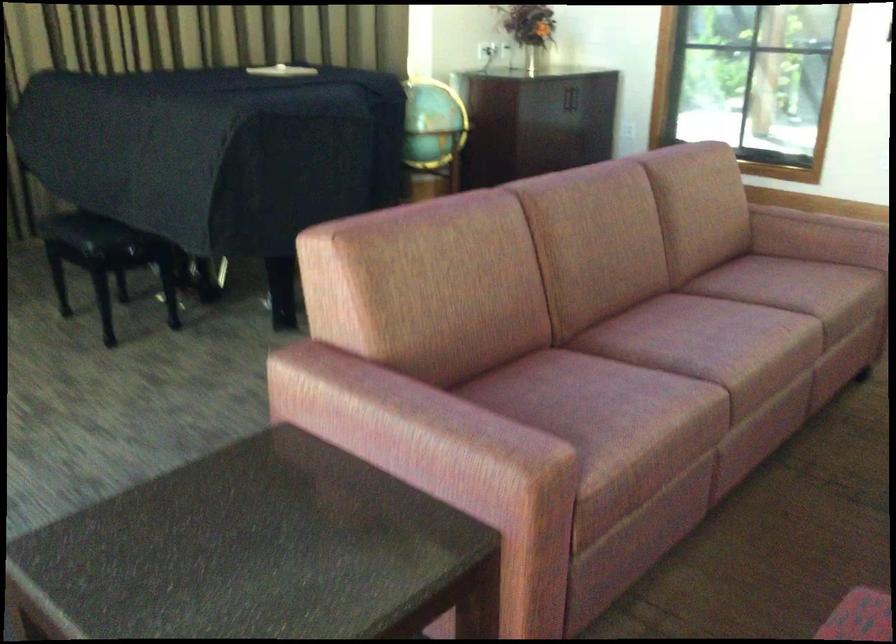
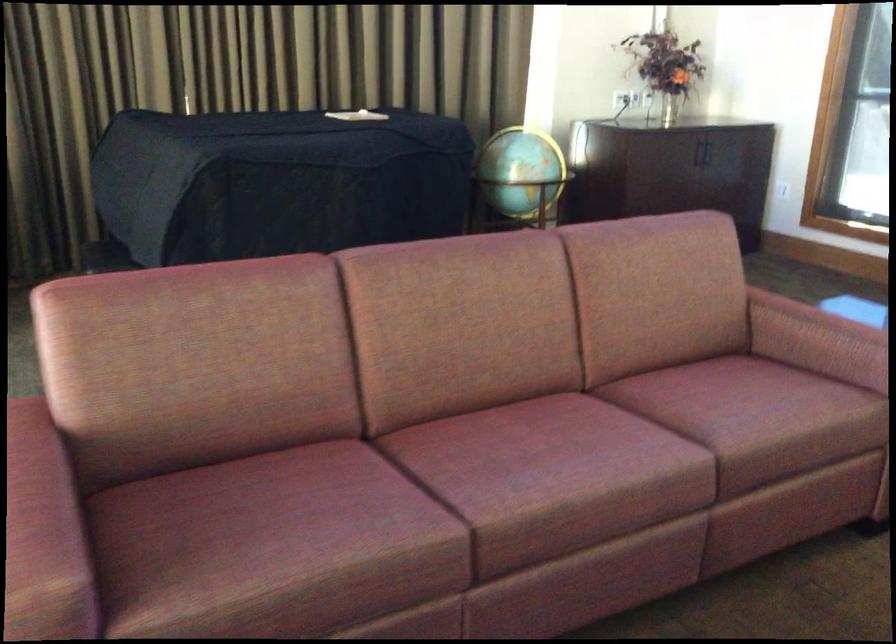
Which direction would the cameraman need to move to produce the second image?

The cameraman moved toward right, forward.